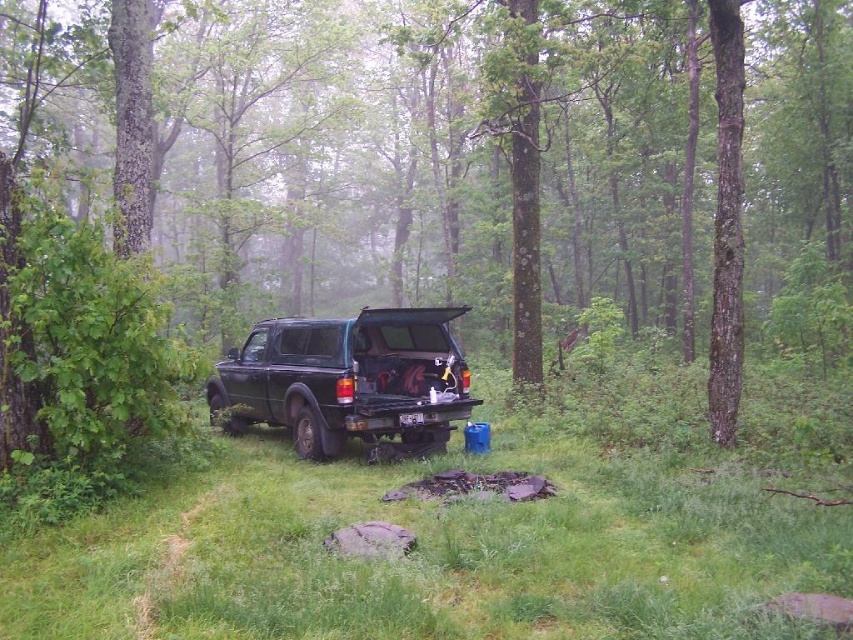
You are a photographer trying to capture the matte black truck at center without the green leafy tree at center blocking the view. Based on their positions, is it possible to frame the shot so the truck is fully visible without the tree overlapping?

The green leafy tree at center is above the matte black truck at center, so it is blocking the truck. To frame the shot so the truck is fully visible without the tree overlapping, you would need to position the camera below the tree or adjust the angle to avoid the tree.

You are a hiker who needs to reach the green leafy tree at center from the matte black truck at center. Can you walk directly between them without any obstacles?

The distance between the green leafy tree at center and the matte black truck at center is 20.00 meters. Since there are no mentioned obstacles in the scene description, you can walk directly between them.